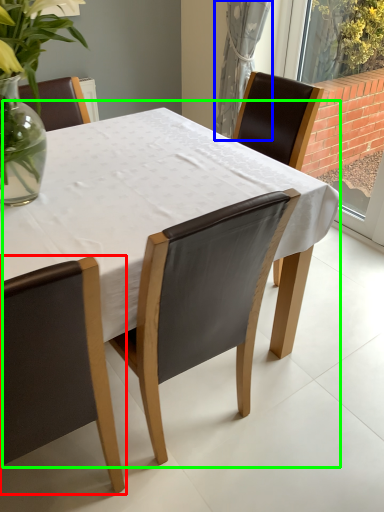
Question: Based on their relative distances, which object is nearer to chair (highlighted by a red box)? Choose from curtain (highlighted by a blue box) and table (highlighted by a green box).

Choices:
 (A) curtain
 (B) table

Answer: (B)